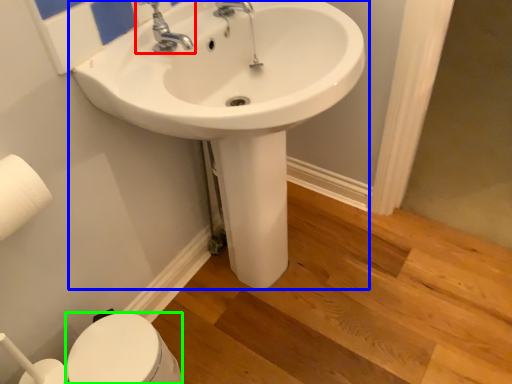
Question: Which object is the closest to the tap (highlighted by a red box)? Choose among these: sink (highlighted by a blue box) or bidet (highlighted by a green box).

Choices:
 (A) sink
 (B) bidet

Answer: (A)